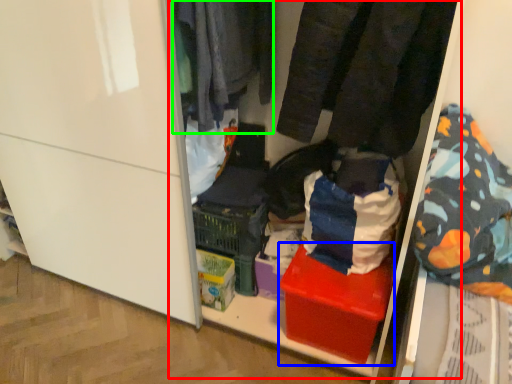
Question: Which object is the farthest from shelf (highlighted by a red box)? Choose among these: box (highlighted by a blue box) or clothing (highlighted by a green box).

Choices:
 (A) box
 (B) clothing

Answer: (A)